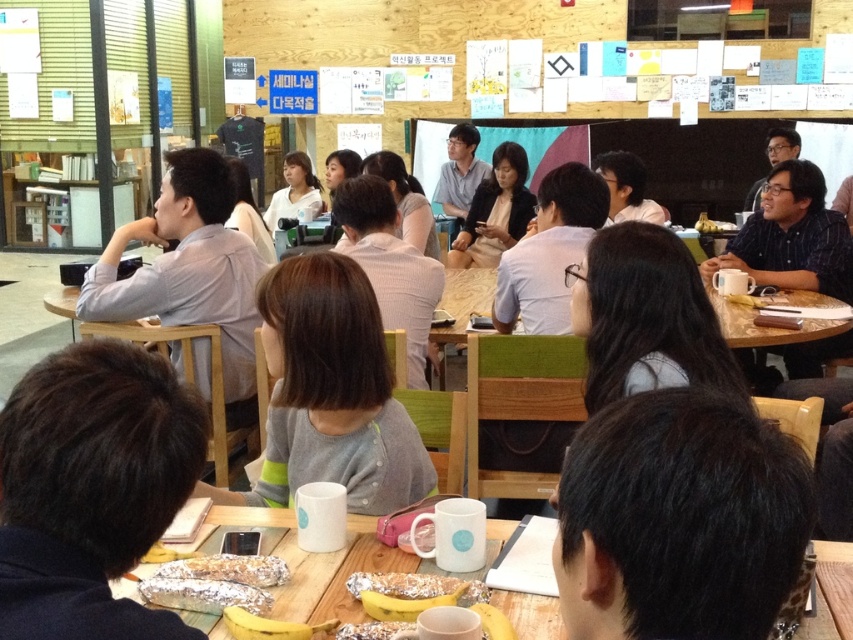
Question: Where is white matte table at lower center located in relation to black matte glasses at upper right in the image?

Choices:
 (A) left
 (B) right

Answer: (A)

Question: Estimate the real-world distances between objects in this image. Which object is closer to the matte black jacket at center?

Choices:
 (A) golden crumbly bread at lower center
 (B) matte brown bread at center
 (C) matte white shirt at upper center
 (D) yellow foil-wrapped banana at lower center

Answer: (C)

Question: Considering the relative positions of dark brown hair at lower left and white shirt at center in the image provided, where is dark brown hair at lower left located with respect to white shirt at center?

Choices:
 (A) left
 (B) right

Answer: (A)

Question: Estimate the real-world distances between objects in this image. Which object is closer to the white matte table at lower center?

Choices:
 (A) black matte glasses at upper right
 (B) white shirt at center
 (C) yellow foil-wrapped banana at lower center
 (D) light gray hoodie at center

Answer: (C)

Question: Which of these objects is positioned closest to the white matte table at lower center?

Choices:
 (A) dark brown hair at lower left
 (B) white shirt at center

Answer: (A)

Question: Considering the relative positions of white textured shirt at center and matte gray shirt at center in the image provided, where is white textured shirt at center located with respect to matte gray shirt at center?

Choices:
 (A) below
 (B) above

Answer: (A)